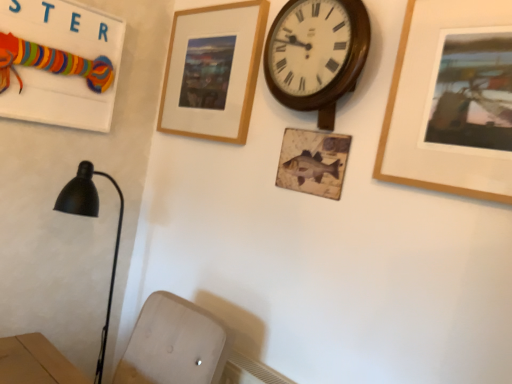
Locate an element on the screen. wooden picture frame at upper right, which is counted as the 2th picture frame, starting from the left is located at coordinates 431,103.

Measure the distance between point (102, 21) and camera.

1.68 meters.

This screenshot has height=384, width=512. In order to click on wooden wall clock at upper center in this screenshot , I will do `click(316, 51)`.

Are wooden signboard at upper left and wooden picture frame at upper center, the 1th picture frame from the left, beside each other?

No, wooden signboard at upper left is not with wooden picture frame at upper center, the 1th picture frame from the left.

In terms of size, does wooden signboard at upper left appear bigger or smaller than wooden picture frame at upper center, the 1th picture frame from the left?

Considering their sizes, wooden signboard at upper left takes up more space than wooden picture frame at upper center, the 1th picture frame from the left.

Identify the location of bulletin board below the wooden picture frame at upper center, the second picture frame positioned from the front (from a real-world perspective). The image size is (512, 384). (60, 63).

From a real-world perspective, which object stands above the other?

wooden picture frame at upper center, which appears as the first picture frame when viewed from the back, is physically above.

Considering the relative sizes of wooden signboard at upper left and wooden wall clock at upper center in the image provided, is wooden signboard at upper left thinner than wooden wall clock at upper center?

Yes, wooden signboard at upper left is thinner than wooden wall clock at upper center.

Considering the sizes of objects wooden signboard at upper left and wooden wall clock at upper center in the image provided, who is smaller, wooden signboard at upper left or wooden wall clock at upper center?

Smaller between the two is wooden signboard at upper left.

Can you confirm if wooden signboard at upper left is shorter than wooden wall clock at upper center?

Incorrect, the height of wooden signboard at upper left does not fall short of that of wooden wall clock at upper center.

From the image's perspective, is wooden signboard at upper left above wooden wall clock at upper center?

Yes.

Is wooden picture frame at upper right, arranged as the first picture frame when viewed from the front, situated inside wooden signboard at upper left or outside?

wooden picture frame at upper right, arranged as the first picture frame when viewed from the front, is spatially situated outside wooden signboard at upper left.

Is wooden picture frame at upper right, which is counted as the 2th picture frame, starting from the left, to the right of wooden signboard at upper left from the viewer's perspective?

Yes.

In terms of height, does wooden picture frame at upper right, which is counted as the 2th picture frame, starting from the left, look taller or shorter compared to wooden signboard at upper left?

Clearly, wooden picture frame at upper right, which is counted as the 2th picture frame, starting from the left, is taller compared to wooden signboard at upper left.

Considering the sizes of wooden wall clock at upper center and wooden picture frame at upper center, the 1th picture frame from the left, in the image, is wooden wall clock at upper center bigger or smaller than wooden picture frame at upper center, the 1th picture frame from the left,?

In the image, wooden wall clock at upper center appears to be larger than wooden picture frame at upper center, the 1th picture frame from the left.

Based on the photo, from a real-world perspective, is wooden wall clock at upper center positioned over wooden picture frame at upper center, which appears as the first picture frame when viewed from the back, based on gravity?

Indeed, from a real-world perspective, wooden wall clock at upper center stands above wooden picture frame at upper center, which appears as the first picture frame when viewed from the back.

Does wooden wall clock at upper center lie behind wooden picture frame at upper center, which is the 2th picture frame in right-to-left order?

No, wooden wall clock at upper center is in front of wooden picture frame at upper center, which is the 2th picture frame in right-to-left order.

Is wooden wall clock at upper center not close to wooden picture frame at upper center, which appears as the first picture frame when viewed from the back?

No, wooden wall clock at upper center is not far from wooden picture frame at upper center, which appears as the first picture frame when viewed from the back.

Which is more to the left, wooden picture frame at upper right, which is counted as the 2th picture frame, starting from the left, or wooden picture frame at upper center, which appears as the first picture frame when viewed from the back?

From the viewer's perspective, wooden picture frame at upper center, which appears as the first picture frame when viewed from the back, appears more on the left side.

From the image's perspective, is wooden picture frame at upper right, the 1th picture frame from the right, below wooden picture frame at upper center, which is the 2th picture frame in right-to-left order?

Yes, from the image's perspective, wooden picture frame at upper right, the 1th picture frame from the right, is beneath wooden picture frame at upper center, which is the 2th picture frame in right-to-left order.

From a real-world perspective, is wooden picture frame at upper right, which is counted as the 2th picture frame, starting from the left, positioned under wooden picture frame at upper center, which appears as the first picture frame when viewed from the back, based on gravity?

Indeed, from a real-world perspective, wooden picture frame at upper right, which is counted as the 2th picture frame, starting from the left, is positioned beneath wooden picture frame at upper center, which appears as the first picture frame when viewed from the back.

In the scene shown: Does wooden picture frame at upper right, which appears as the second picture frame when viewed from the back, have a larger size compared to wooden picture frame at upper center, the 1th picture frame from the left?

No, wooden picture frame at upper right, which appears as the second picture frame when viewed from the back, is not bigger than wooden picture frame at upper center, the 1th picture frame from the left.

Consider the image. Between wooden picture frame at upper center, the 1th picture frame from the left, and wooden signboard at upper left, which one has smaller width?

With smaller width is wooden picture frame at upper center, the 1th picture frame from the left.

In the scene shown: Is wooden picture frame at upper center, the second picture frame positioned from the front, behind wooden signboard at upper left?

Yes, wooden picture frame at upper center, the second picture frame positioned from the front, is further from the camera.

The image size is (512, 384). I want to click on bulletin board in front of the wooden picture frame at upper center, the 1th picture frame from the left, so click(x=60, y=63).

Can you tell me how much wooden picture frame at upper center, the 1th picture frame from the left, and wooden signboard at upper left differ in facing direction?

The angular difference between wooden picture frame at upper center, the 1th picture frame from the left, and wooden signboard at upper left is 87.6 degrees.

How distant is wooden wall clock at upper center from wooden picture frame at upper right, which is counted as the 2th picture frame, starting from the left?

They are 10.28 inches apart.

How many degrees apart are the facing directions of wooden wall clock at upper center and wooden picture frame at upper right, which appears as the second picture frame when viewed from the back?

wooden wall clock at upper center and wooden picture frame at upper right, which appears as the second picture frame when viewed from the back, are facing 0.746 degrees away from each other.

Which of these two, wooden wall clock at upper center or wooden picture frame at upper right, the 1th picture frame from the right, is smaller?

wooden picture frame at upper right, the 1th picture frame from the right, is smaller.

Could you tell me if wooden wall clock at upper center is facing wooden picture frame at upper right, which appears as the second picture frame when viewed from the back?

No.

At what (x,y) coordinates should I click in order to perform the action: click on picture frame located above the wooden signboard at upper left (from the image's perspective). Please return your answer as a coordinate pair (x, y). The height and width of the screenshot is (384, 512). Looking at the image, I should click on (213, 71).

Find the location of a particular element. wall clock that appears below the wooden signboard at upper left (from the image's perspective) is located at coordinates (316, 51).

Considering their positions, is wooden wall clock at upper center positioned closer to wooden picture frame at upper center, which is the 2th picture frame in right-to-left order, than wooden signboard at upper left?

wooden wall clock at upper center.

Considering their positions, is wooden picture frame at upper right, which appears as the second picture frame when viewed from the back, positioned closer to wooden signboard at upper left than wooden wall clock at upper center?

Based on the image, wooden wall clock at upper center appears to be nearer to wooden signboard at upper left.

Consider the image. Estimate the real-world distances between objects in this image. Which object is closer to wooden wall clock at upper center, wooden picture frame at upper center, which appears as the first picture frame when viewed from the back, or wooden signboard at upper left?

wooden picture frame at upper center, which appears as the first picture frame when viewed from the back.

From the image, which object appears to be farther from wooden picture frame at upper right, which appears as the second picture frame when viewed from the back, wooden signboard at upper left or wooden picture frame at upper center, the 1th picture frame from the left?

wooden signboard at upper left is further to wooden picture frame at upper right, which appears as the second picture frame when viewed from the back.

From the image, which object appears to be nearer to wooden wall clock at upper center, wooden signboard at upper left or wooden picture frame at upper right, which appears as the second picture frame when viewed from the back?

wooden picture frame at upper right, which appears as the second picture frame when viewed from the back.

Based on their spatial positions, is wooden picture frame at upper right, arranged as the first picture frame when viewed from the front, or wooden signboard at upper left further from wooden wall clock at upper center?

wooden signboard at upper left.

Looking at the image, which one is located closer to wooden wall clock at upper center, wooden picture frame at upper center, the second picture frame positioned from the front, or wooden picture frame at upper right, which is counted as the 2th picture frame, starting from the left?

Among the two, wooden picture frame at upper right, which is counted as the 2th picture frame, starting from the left, is located nearer to wooden wall clock at upper center.

Considering their positions, is wooden wall clock at upper center positioned closer to wooden picture frame at upper center, the 1th picture frame from the left, than wooden picture frame at upper right, which is counted as the 2th picture frame, starting from the left?

Based on the image, wooden wall clock at upper center appears to be nearer to wooden picture frame at upper center, the 1th picture frame from the left.

Locate an element on the screen. The height and width of the screenshot is (384, 512). picture frame situated between wooden signboard at upper left and wooden wall clock at upper center from left to right is located at coordinates (213, 71).

Identify the location of wall clock between wooden picture frame at upper center, the second picture frame positioned from the front, and wooden picture frame at upper right, arranged as the first picture frame when viewed from the front, from left to right. Image resolution: width=512 pixels, height=384 pixels. (316, 51).

Identify the location of wall clock situated between wooden signboard at upper left and wooden picture frame at upper right, arranged as the first picture frame when viewed from the front, from left to right. This screenshot has height=384, width=512. (316, 51).

In order to click on picture frame between wooden signboard at upper left and wooden picture frame at upper right, the 1th picture frame from the right, from left to right in this screenshot , I will do `click(213, 71)`.